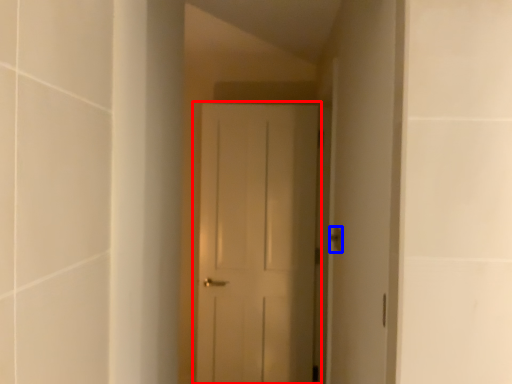
Question: Which object is further to the camera taking this photo, door (highlighted by a red box) or door handle (highlighted by a blue box)?

Choices:
 (A) door
 (B) door handle

Answer: (A)